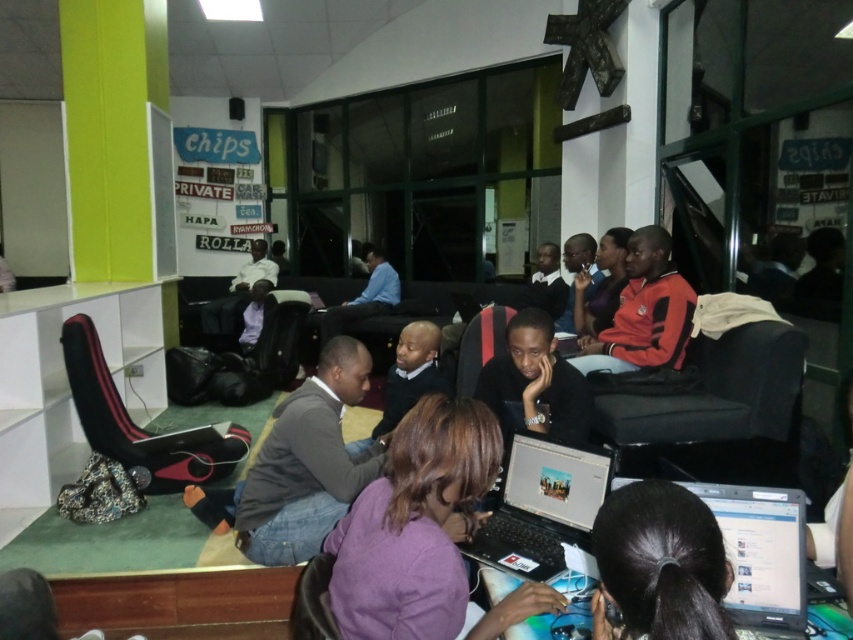
Who is higher up, silver metallic laptop at center or orange fleece jacket at center?

Positioned higher is orange fleece jacket at center.

What do you see at coordinates (541, 506) in the screenshot? This screenshot has width=853, height=640. I see `silver metallic laptop at center` at bounding box center [541, 506].

I want to click on silver metallic laptop at center, so click(x=541, y=506).

You are a GUI agent. You are given a task and a screenshot of the screen. Output one action in this format:
    pyautogui.click(x=<x>, y=<y>)
    Task: Click on the purple matte laptop at center
    The image size is (853, 640).
    Given the screenshot: What is the action you would take?
    pyautogui.click(x=413, y=525)

Who is higher up, black glossy hair at lower center or silver metallic laptop at center?

black glossy hair at lower center is above.

Looking at this image, is black glossy hair at lower center to the right of silver metallic laptop at center from the viewer's perspective?

Indeed, black glossy hair at lower center is positioned on the right side of silver metallic laptop at center.

Is point (659, 630) closer to camera compared to point (503, 560)?

Yes, it is in front of point (503, 560).

I want to click on black glossy hair at lower center, so click(660, 564).